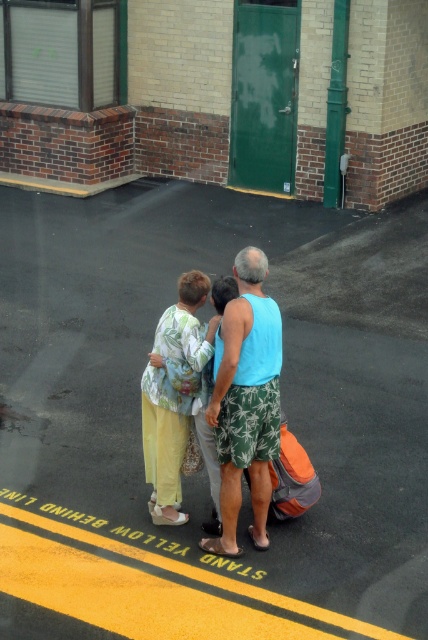
You are a delivery person with a 10 feet long package that needs to be placed between the black asphalt at center and the floral fabric blouse at center. Is there enough space to place the package without overlapping either object?

The black asphalt at center is 11.00 feet away from the floral fabric blouse at center. Since the package is 10 feet long, there is enough space to place it between them without overlapping either object.

You are standing at the bus stop and want to hand a note to the person wearing the blue fabric tank top at center. If you are at point A, which is the origin point, and the blue fabric tank top at center is located at point B, which is at coordinate point (246, 401), in which direction should you walk to reach them?

You should walk towards the coordinate point (246, 401) to reach the blue fabric tank top at center.

You are standing at point (362, 488) and want to reach the bus stop. The bus stop is 7.82 meters away from you. If you can walk 1.5 meters per second, how many seconds will it take you to reach the bus stop?

It will take approximately 5.21 seconds to reach the bus stop since 7.82 meters divided by 1.5 meters per second equals approximately 5.21 seconds.